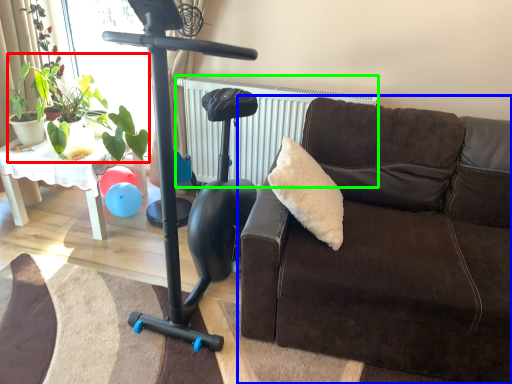
Question: Which object is positioned closest to plant (highlighted by a red box)? Select from studio couch (highlighted by a blue box) and radiator (highlighted by a green box).

Choices:
 (A) studio couch
 (B) radiator

Answer: (B)